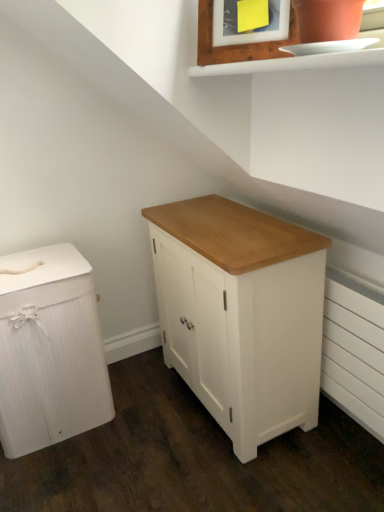
Question: Is wooden picture frame at upper center facing towards white wood chest of drawers at left, the second chest of drawers positioned from the right?

Choices:
 (A) yes
 (B) no

Answer: (B)

Question: From a real-world perspective, is wooden picture frame at upper center located beneath white wood chest of drawers at left, the second chest of drawers positioned from the right?

Choices:
 (A) no
 (B) yes

Answer: (A)

Question: From a real-world perspective, is wooden picture frame at upper center positioned over white wood chest of drawers at left, the second chest of drawers positioned from the right, based on gravity?

Choices:
 (A) no
 (B) yes

Answer: (B)

Question: Is wooden picture frame at upper center completely or partially outside of white wood chest of drawers at left, the second chest of drawers positioned from the right?

Choices:
 (A) yes
 (B) no

Answer: (A)

Question: Considering the relative sizes of wooden picture frame at upper center and white wood chest of drawers at left, the second chest of drawers positioned from the right, in the image provided, is wooden picture frame at upper center smaller than white wood chest of drawers at left, the second chest of drawers positioned from the right,?

Choices:
 (A) yes
 (B) no

Answer: (A)

Question: From the image's perspective, is white painted wood cabinet at center, marked as the second chest of drawers in a left-to-right arrangement, above or below white wood chest of drawers at left, the second chest of drawers positioned from the right?

Choices:
 (A) below
 (B) above

Answer: (B)

Question: In terms of height, does white painted wood cabinet at center, marked as the second chest of drawers in a left-to-right arrangement, look taller or shorter compared to white wood chest of drawers at left, the second chest of drawers positioned from the right?

Choices:
 (A) short
 (B) tall

Answer: (B)

Question: From a real-world perspective, relative to white wood chest of drawers at left, which is the 1th chest of drawers in left-to-right order, is white painted wood cabinet at center, marked as the second chest of drawers in a left-to-right arrangement, vertically above or below?

Choices:
 (A) below
 (B) above

Answer: (B)

Question: Looking at the image, does white painted wood cabinet at center, marked as the second chest of drawers in a left-to-right arrangement, seem bigger or smaller compared to white wood chest of drawers at left, which is the 1th chest of drawers in left-to-right order?

Choices:
 (A) big
 (B) small

Answer: (A)

Question: Considering the positions of white painted radiator at lower right and wooden picture frame at upper center in the image, is white painted radiator at lower right bigger or smaller than wooden picture frame at upper center?

Choices:
 (A) small
 (B) big

Answer: (B)

Question: Is white painted radiator at lower right taller or shorter than wooden picture frame at upper center?

Choices:
 (A) tall
 (B) short

Answer: (A)

Question: Considering the relative positions of white painted radiator at lower right and wooden picture frame at upper center in the image provided, is white painted radiator at lower right to the left or to the right of wooden picture frame at upper center?

Choices:
 (A) left
 (B) right

Answer: (B)

Question: Is point (326, 357) positioned closer to the camera than point (210, 11)?

Choices:
 (A) closer
 (B) farther

Answer: (B)

Question: In terms of height, does wooden picture frame at upper center look taller or shorter compared to white painted radiator at lower right?

Choices:
 (A) short
 (B) tall

Answer: (A)

Question: In terms of width, does wooden picture frame at upper center look wider or thinner when compared to white painted radiator at lower right?

Choices:
 (A) thin
 (B) wide

Answer: (B)